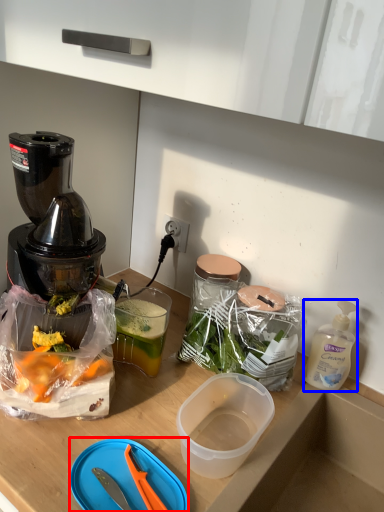
Question: Which point is further to the camera, cutting board (highlighted by a red box) or bottle (highlighted by a blue box)?

Choices:
 (A) cutting board
 (B) bottle

Answer: (B)